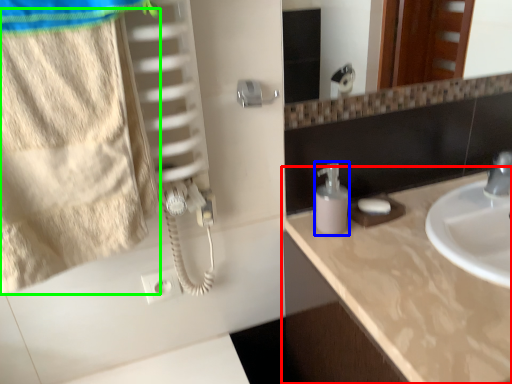
Question: Which object is positioned farthest from countertop (highlighted by a red box)? Select from soap dispenser (highlighted by a blue box) and beach towel (highlighted by a green box).

Choices:
 (A) soap dispenser
 (B) beach towel

Answer: (B)